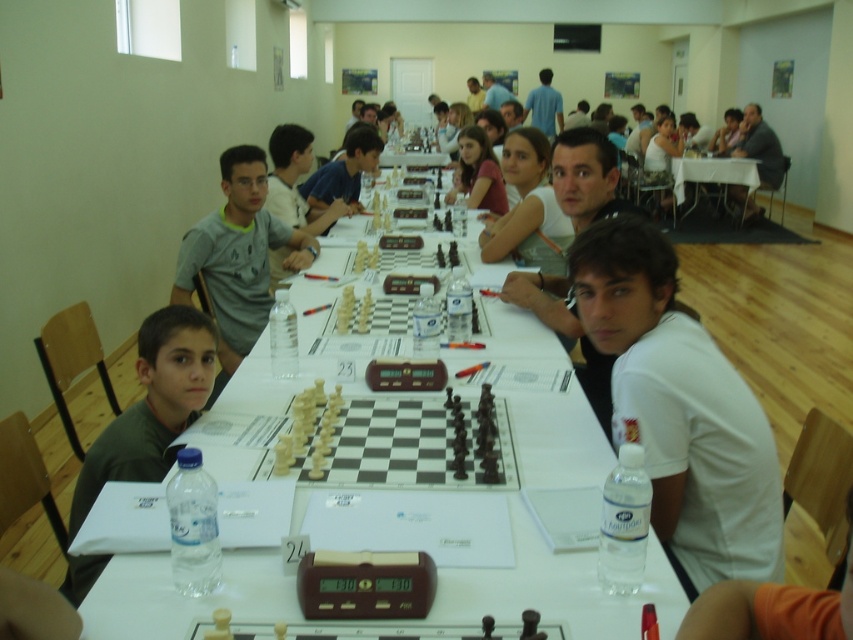
You are a photographer standing at the back of the room. You want to take a photo of the white cotton shirt at center and the white plastic table at center. Which object will appear larger in the photo?

The white cotton shirt at center will appear larger in the photo because it is much taller than the white plastic table at center.

You are a tournament organizer and need to determine if the white plastic chess set at center can be moved to a storage box that can only accommodate items narrower than the gray cotton shirt at center. Can the chess set fit?

The white plastic chess set at center is wider than the gray cotton shirt at center, so it cannot fit into the storage box designed for items narrower than the gray cotton shirt at center.